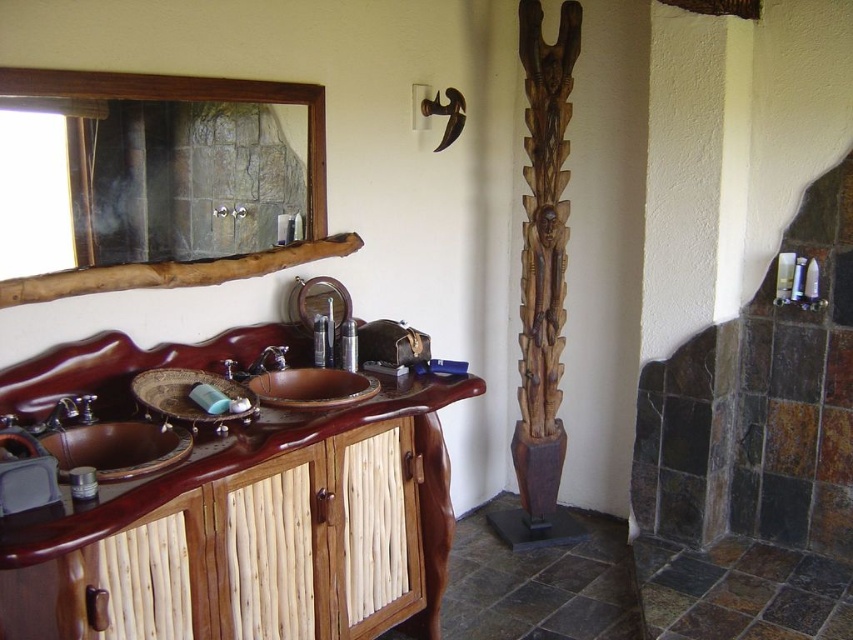
Question: Where is brown wood vanity at center located in relation to brushed metal faucet at left in the image?

Choices:
 (A) above
 (B) below

Answer: (B)

Question: Is brown wood vanity at center above brown wood sink at left?

Choices:
 (A) no
 (B) yes

Answer: (A)

Question: Considering the real-world distances, which object is farthest from the brown wood vanity at center?

Choices:
 (A) brushed metal faucet at left
 (B) brushed metal faucet at center
 (C) brown wooden bowl at center
 (D) brown wooden sink at center

Answer: (A)

Question: Which is farther from the brown wood sink at left?

Choices:
 (A) brown wood vanity at center
 (B) brushed metal faucet at left
 (C) wooden frame mirror at upper left
 (D) brown wooden sink at center

Answer: (C)

Question: Where is brown wood vanity at center located in relation to brown wooden bowl at center in the image?

Choices:
 (A) above
 (B) below

Answer: (B)

Question: Which object is positioned closest to the brushed metal faucet at center?

Choices:
 (A) brown wooden bowl at center
 (B) brown wood sink at left

Answer: (A)